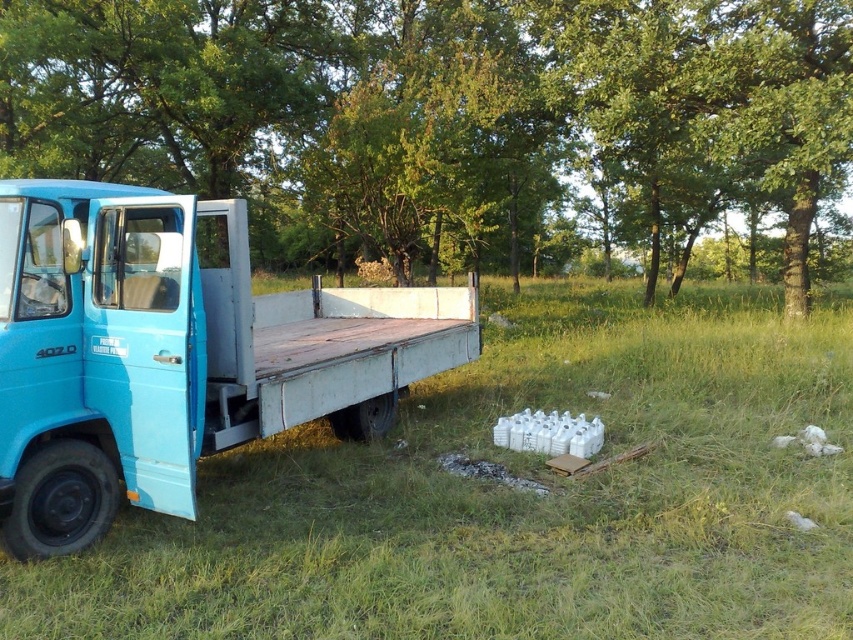
Question: Which point is closer to the camera?

Choices:
 (A) (219, 337)
 (B) (688, 33)
 (C) (236, 627)

Answer: (C)

Question: Considering the relative positions of green grassy at lower left and blue matte truck at left in the image provided, where is green grassy at lower left located with respect to blue matte truck at left?

Choices:
 (A) right
 (B) left

Answer: (A)

Question: Which object appears farthest from the camera in this image?

Choices:
 (A) blue matte truck at left
 (B) green grassy at lower left

Answer: (A)

Question: Does green leafy tree at upper center appear over blue matte truck at left?

Choices:
 (A) no
 (B) yes

Answer: (B)

Question: Can you confirm if green grassy at lower left is positioned above blue matte truck at left?

Choices:
 (A) no
 (B) yes

Answer: (A)

Question: Which of the following is the farthest from the observer?

Choices:
 (A) green grassy at lower left
 (B) blue matte truck at left

Answer: (B)